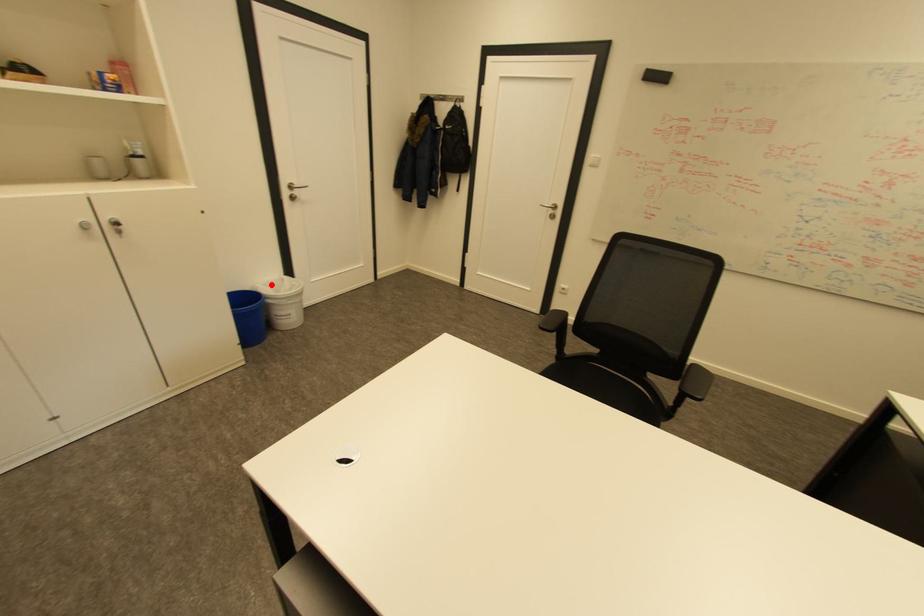
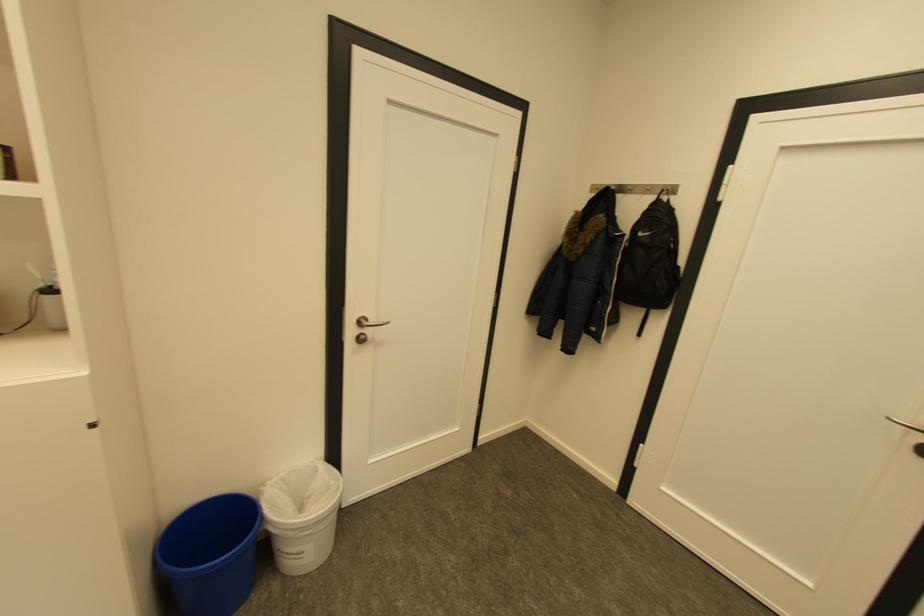
Locate, in the second image, the point that corresponds to the highlighted location in the first image.

(289, 477)